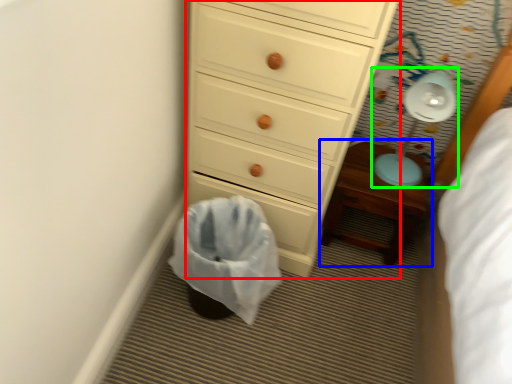
Question: Considering the real-world distances, which object is farthest from chest of drawers (highlighted by a red box)? nightstand (highlighted by a blue box) or lamp (highlighted by a green box)?

Choices:
 (A) nightstand
 (B) lamp

Answer: (B)